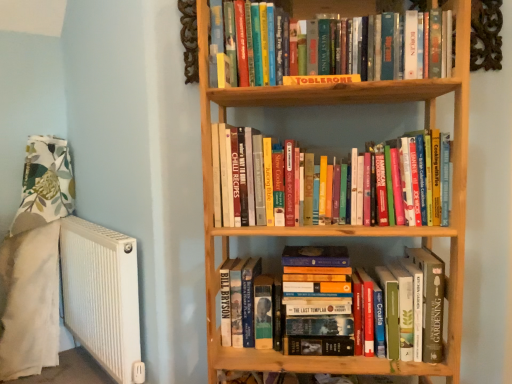
Question: Is hardcover books at lower center, which is the third book from top to bottom, a part of hardcover books at center, which appears as the 2th book when viewed from the top?

Choices:
 (A) yes
 (B) no

Answer: (B)

Question: From a real-world perspective, is hardcover books at center, which appears as the 2th book when viewed from the top, beneath hardcover books at lower center, which is the third book from top to bottom?

Choices:
 (A) yes
 (B) no

Answer: (B)

Question: Does hardcover books at center, arranged as the 2th book when ordered from the bottom, appear on the right side of hardcover books at lower center, which is the first book in bottom-to-top order?

Choices:
 (A) no
 (B) yes

Answer: (A)

Question: Could you tell me if hardcover books at center, arranged as the 2th book when ordered from the bottom, is turned towards hardcover books at lower center, which is the first book in bottom-to-top order?

Choices:
 (A) yes
 (B) no

Answer: (B)

Question: Is hardcover books at center, which appears as the 2th book when viewed from the top, far from hardcover books at lower center, which is the first book in bottom-to-top order?

Choices:
 (A) yes
 (B) no

Answer: (B)

Question: Is point (215, 329) positioned closer to the camera than point (109, 342)?

Choices:
 (A) closer
 (B) farther

Answer: (A)

Question: Is wooden bookcase at center taller or shorter than white ribbed radiator at left?

Choices:
 (A) short
 (B) tall

Answer: (B)

Question: Considering the relative positions of wooden bookcase at center and white ribbed radiator at left in the image provided, is wooden bookcase at center to the left or to the right of white ribbed radiator at left?

Choices:
 (A) right
 (B) left

Answer: (A)

Question: Considering their positions, is wooden bookcase at center located in front of or behind white ribbed radiator at left?

Choices:
 (A) behind
 (B) front

Answer: (B)

Question: Which is correct: yellow cardboard toblerone at upper center, which is the 1th book in top-to-bottom order, is inside hardcover books at center, arranged as the 2th book when ordered from the bottom, or outside of it?

Choices:
 (A) outside
 (B) inside

Answer: (A)

Question: In terms of size, does yellow cardboard toblerone at upper center, which is the 1th book in top-to-bottom order, appear bigger or smaller than hardcover books at center, arranged as the 2th book when ordered from the bottom?

Choices:
 (A) small
 (B) big

Answer: (A)

Question: Looking at their shapes, would you say yellow cardboard toblerone at upper center, which is the 1th book in top-to-bottom order, is wider or thinner than hardcover books at center, arranged as the 2th book when ordered from the bottom?

Choices:
 (A) wide
 (B) thin

Answer: (A)

Question: From their relative heights in the image, would you say yellow cardboard toblerone at upper center, which is the 1th book in top-to-bottom order, is taller or shorter than hardcover books at center, arranged as the 2th book when ordered from the bottom?

Choices:
 (A) short
 (B) tall

Answer: (A)

Question: In terms of width, does white ribbed radiator at left look wider or thinner when compared to wooden bookcase at center?

Choices:
 (A) wide
 (B) thin

Answer: (B)

Question: Is point (131, 370) positioned closer to the camera than point (437, 87)?

Choices:
 (A) farther
 (B) closer

Answer: (A)